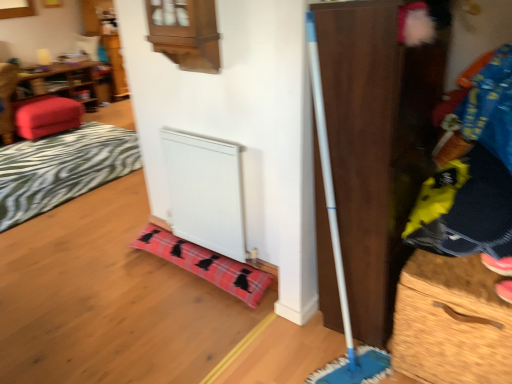
Find the location of `unoccupied area in front of plaid fabric blanket at lower center, which is counted as the second blanket, starting from the back`. unoccupied area in front of plaid fabric blanket at lower center, which is counted as the second blanket, starting from the back is located at coordinates (172, 324).